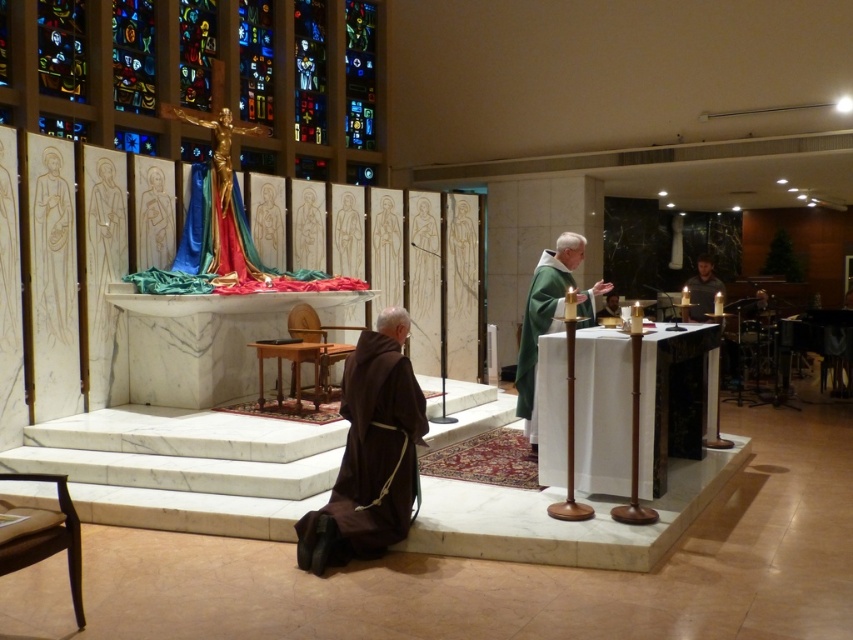
You are an interior designer planning to place a decorative item in this church scene. You have a small statue that is 30 cm wide. The brown cloth at lower left and the wooden carving of person at upper left are already present. Which object can the statue fit next to without exceeding its width?

The small statue that is 30 cm wide can fit next to the wooden carving of person at upper left because the brown cloth at lower left is wider than the wooden carving of person at upper left, so the statue would exceed the width if placed next to the brown cloth at lower left.

You are an interior designer assessing the layout of this religious space. You need to determine if the brown cloth at lower left can be seen over the wooden carving of person at upper left from the entrance. Based on their heights, what is your conclusion?

The brown cloth at lower left is taller than the wooden carving of person at upper left. Therefore, the brown cloth at lower left would likely obstruct the view of the wooden carving of person at upper left from the entrance.

You are an art student analyzing the composition of this religious artwork. Which statue, the white marble statue at upper left or the matte gold statue at center, is positioned closer to the viewer?

The white marble statue at upper left is positioned closer to the viewer than the matte gold statue at center because it is in front of it.